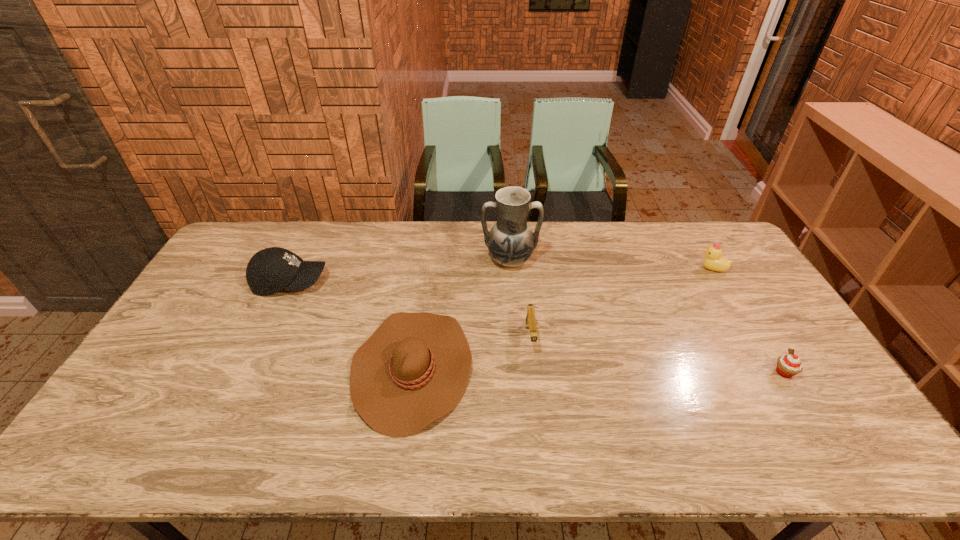
At what (x,y) coordinates should I click in order to perform the action: click on empty location between the pistol and the leftmost object. Please return your answer as a coordinate pair (x, y). Looking at the image, I should click on (410, 310).

You are a GUI agent. You are given a task and a screenshot of the screen. Output one action in this format:
    pyautogui.click(x=<x>, y=<y>)
    Task: Click on the blank region between the pistol and the fifth object from right to left
    
    Given the screenshot: What is the action you would take?
    pyautogui.click(x=471, y=353)

This screenshot has width=960, height=540. What are the coordinates of `vacant point located between the baseball cap and the second object from left to right` in the screenshot? It's located at (351, 325).

At what (x,y) coordinates should I click in order to perform the action: click on free space between the pitcher and the pistol. Please return your answer as a coordinate pair (x, y). Looking at the image, I should click on (520, 299).

This screenshot has height=540, width=960. What are the coordinates of `free area in between the fifth shortest object and the second object from left to right` in the screenshot? It's located at (351, 325).

I want to click on the closest object to the cupcake, so click(713, 261).

Identify the location of object that stands as the fifth closest to the leftmost object. This screenshot has height=540, width=960. pos(790,365).

Find the location of a particular element. Image resolution: width=960 pixels, height=540 pixels. vacant space that satisfies the following two spatial constraints: 1. on the front-facing side of the pitcher; 2. on the front-facing side of the baseball cap is located at coordinates (512, 282).

In order to click on free space that satisfies the following two spatial constraints: 1. on the front-facing side of the second tallest object; 2. on the back side of the cupcake in this screenshot , I will do `click(248, 372)`.

The image size is (960, 540). I want to click on vacant area in the image that satisfies the following two spatial constraints: 1. on the front-facing side of the cupcake; 2. on the left side of the tallest object, so click(x=518, y=372).